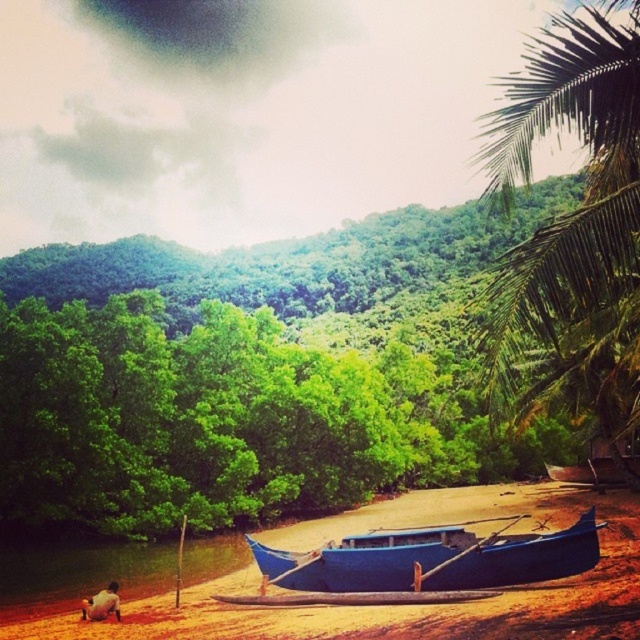
You are planning to take a photo of the blue wooden canoe at center and the green leafy palm tree at right. Which object should you focus on first if you want to capture both in a single frame without moving the camera?

The green leafy palm tree at right is located above the blue wooden canoe at center, so you should focus on the blue wooden canoe at center first to ensure both are in frame.

You are standing at the edge of the tropical riverbank and want to take a photo of the green leafy palm tree at right and the blue wooden canoe at center. Which object should you frame first in your camera to ensure both are in the shot?

The green leafy palm tree at right is positioned on the right side of the blue wooden canoe at center, so you should frame the blue wooden canoe at center first to ensure both are in the shot.

You are standing at the center of the image and want to walk to the blue polished wood boat at center. Which direction should you head towards?

The blue polished wood boat at center is located at point 0.873 on the x axis and 0.677 on the y axis, so you should head towards the lower right direction from the center to reach it.